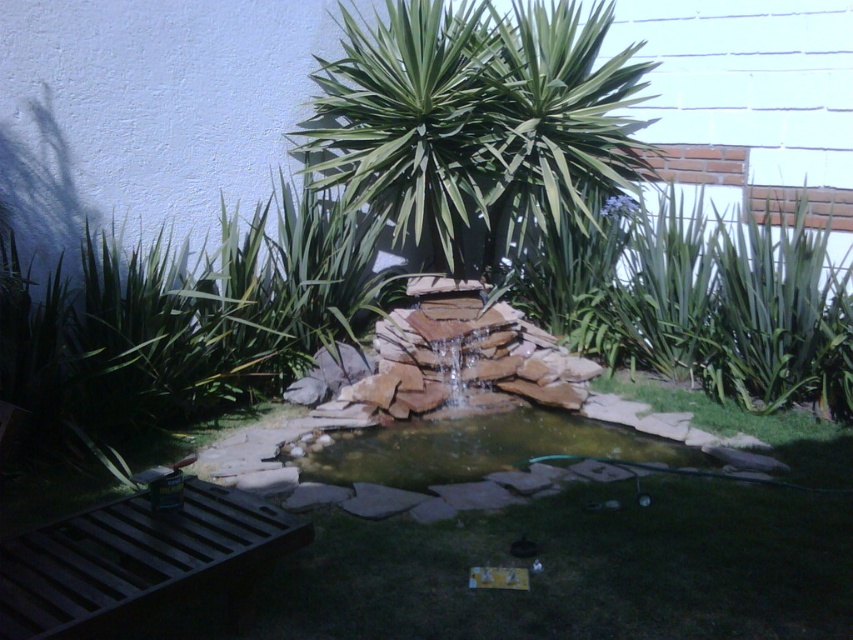
You are a gardener planning to plant a new flower bed between the green leafy palm tree at center and the brown stone pond at center. Which object should you avoid placing the flowers too close to in order to ensure proper drainage?

You should avoid placing the flowers too close to the brown stone pond at center because the green leafy palm tree at center is positioned over it, which may affect drainage around the pond.

In the scene shown: You are standing in the garden and want to take a photo of the green leafy palm tree at center. If your camera can focus on objects up to 15 feet away, will you need to move closer or farther away to get a clear shot?

The green leafy palm tree at center is 17.40 feet away from the camera, which is beyond the 15 feet focus range. To get a clear shot, you need to move closer to reduce the distance.